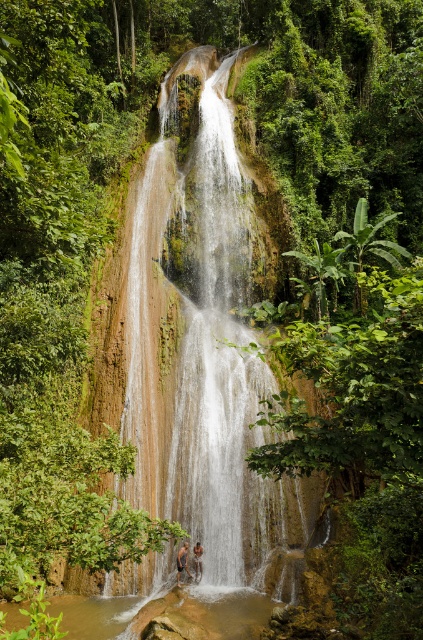
You are a photographer planning to capture the brown textured hair at lower center and the brown textured skin at center in a single frame. Given their sizes, which object should you focus on to ensure both fit clearly in the photo?

The brown textured hair at lower center is bigger than the brown textured skin at center, so focusing on the brown textured hair at lower center would ensure both objects fit clearly in the photo.